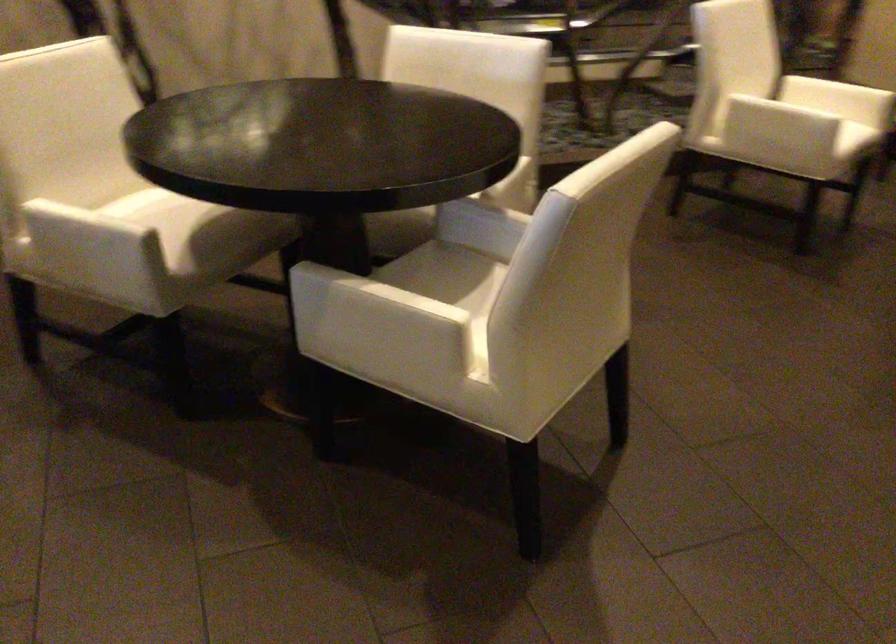
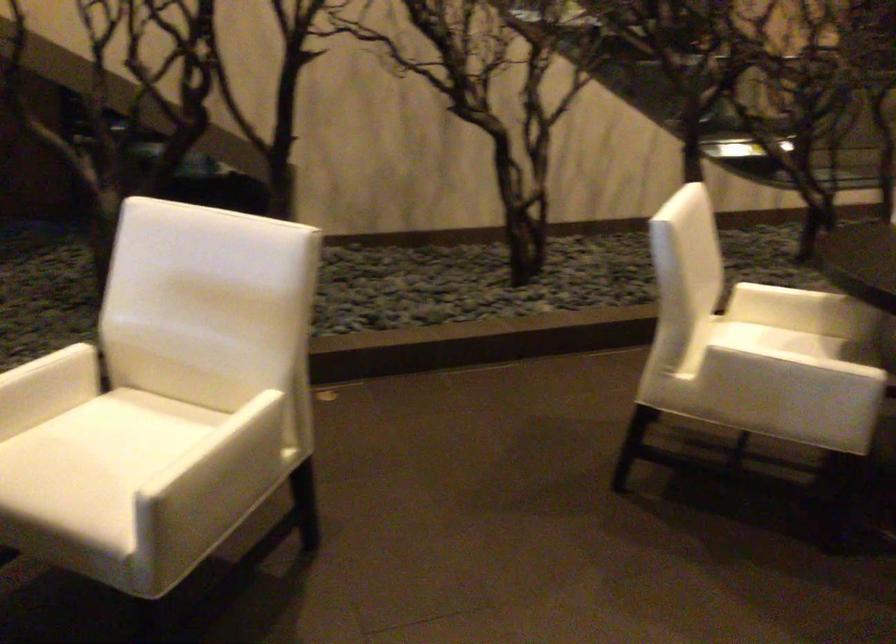
The point at (167, 207) is marked in the first image. Where is the corresponding point in the second image?

(791, 341)